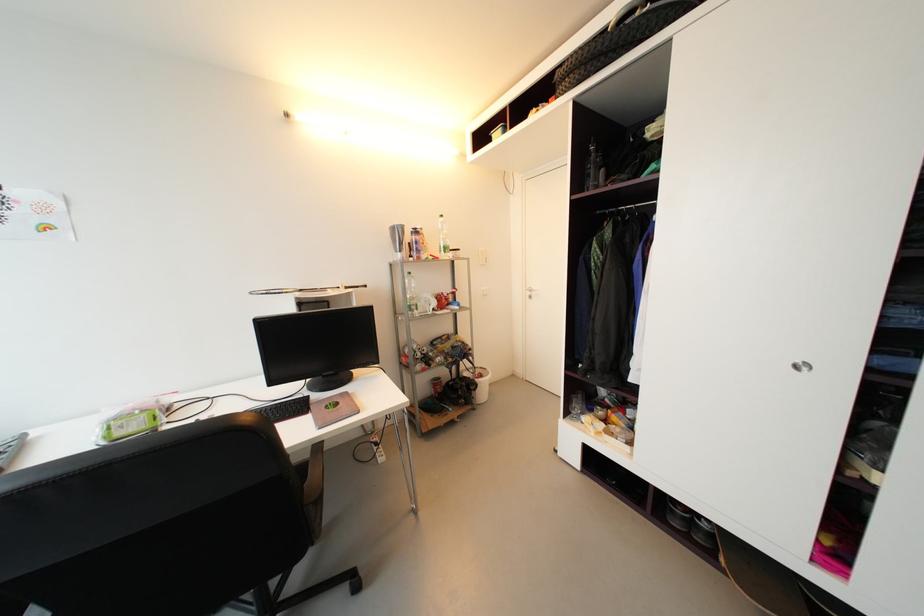
Describe the element at coordinates (801, 367) in the screenshot. I see `the round metal handle` at that location.